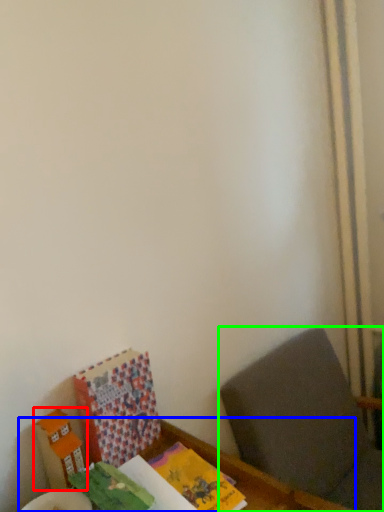
Question: Which object is the farthest from cardboard box (highlighted by a red box)? Choose among these: table (highlighted by a blue box) or furniture (highlighted by a green box).

Choices:
 (A) table
 (B) furniture

Answer: (B)